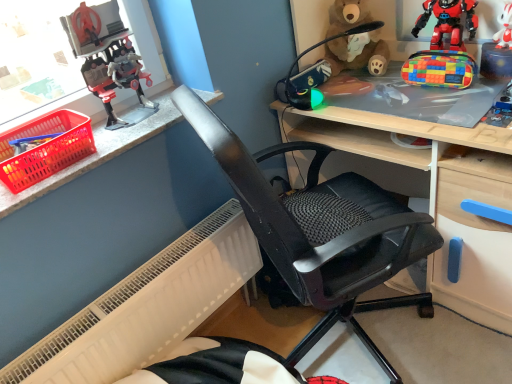
Question: From a real-world perspective, is white matte plush toy at upper right, the 1th toy in the right-to-left sequence, above or below smooth stone counter top at upper left?

Choices:
 (A) above
 (B) below

Answer: (A)

Question: Is white matte plush toy at upper right, the 1th toy in the right-to-left sequence, taller or shorter than smooth stone counter top at upper left?

Choices:
 (A) short
 (B) tall

Answer: (B)

Question: Considering the real-world distances, which object is closest to the black mesh office chair at center?

Choices:
 (A) plastic robot at upper left, the first toy from the left
 (B) white matte plush toy at upper right, which appears as the fifth toy when viewed from the left
 (C) multicolored plastic toy at upper right, arranged as the second toy when viewed from the right
 (D) brown plush toy at upper right, placed as the second toy when sorted from left to right
 (E) brown plush bear at upper center

Answer: (D)

Question: Based on their relative distances, which object is farther from the white matte plush toy at upper right, the 1th toy in the right-to-left sequence?

Choices:
 (A) translucent plastic basket at left
 (B) brown plush toy at upper right, placed as the second toy when sorted from left to right
 (C) smooth stone counter top at upper left
 (D) plastic robot at upper left, which is the fifth toy in right-to-left order
 (E) multicolored plastic toy at upper right, arranged as the second toy when viewed from the right

Answer: (A)